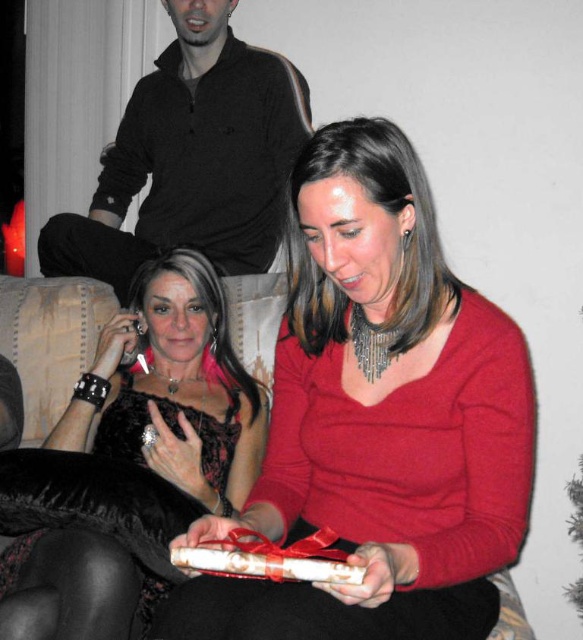
You are a photographer setting up for a group photo. You need to position a light source between the black matte shirt at upper center and the white paper gift at center. What is the minimum distance the light should be placed from each object to ensure even illumination?

The light source should be placed exactly halfway between the black matte shirt at upper center and the white paper gift at center, which are 1.20 meters apart. This means the light should be 0.60 meters away from each object to ensure equal distance and even illumination.